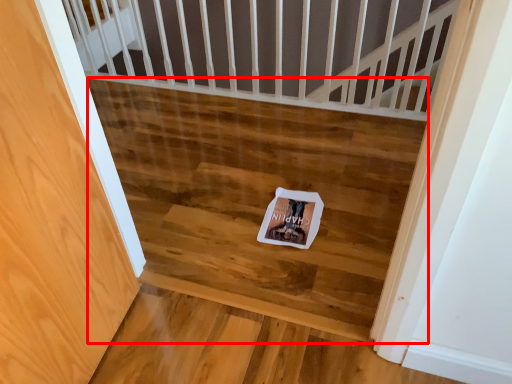
Question: Observing the image, what is the correct spatial positioning of stairwell (annotated by the red box) in reference to postcard?

Choices:
 (A) left
 (B) right

Answer: (A)